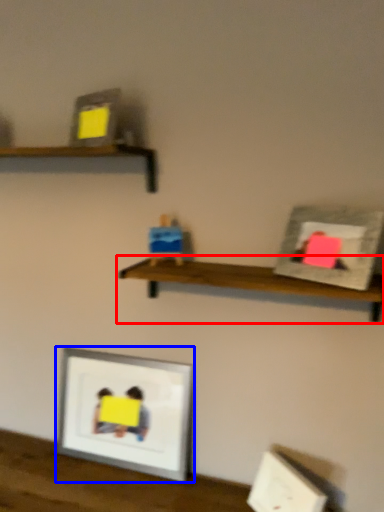
Question: Which object appears farthest to the camera in this image, shelf (highlighted by a red box) or picture frame (highlighted by a blue box)?

Choices:
 (A) shelf
 (B) picture frame

Answer: (B)